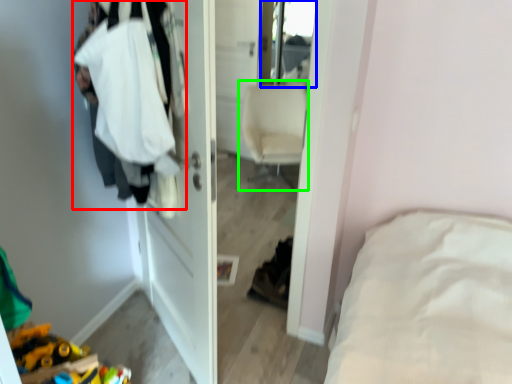
Question: Which object is the closest to the clothing (highlighted by a red box)? Choose among these: mirror (highlighted by a blue box) or chair (highlighted by a green box).

Choices:
 (A) mirror
 (B) chair

Answer: (B)